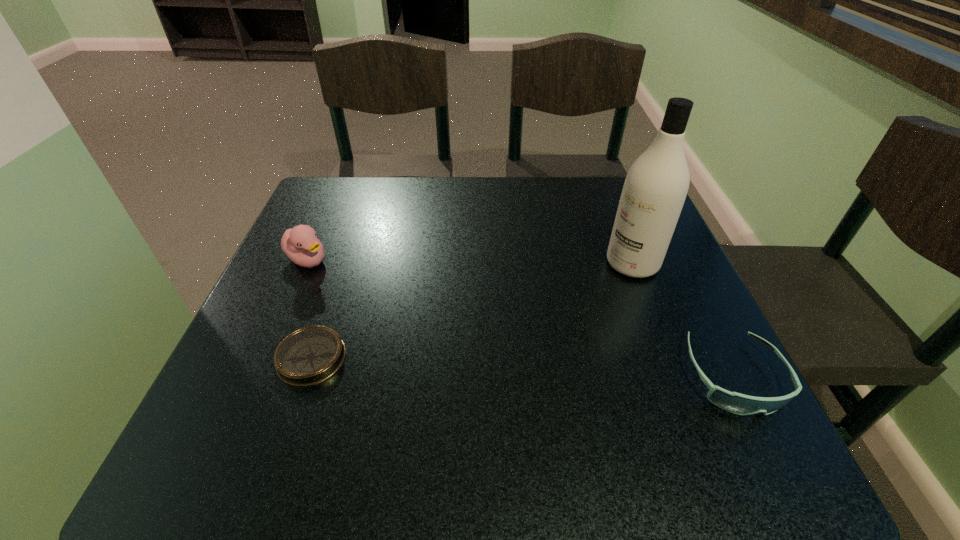
Where is `free space at the near edge`? free space at the near edge is located at coordinates (501, 414).

Image resolution: width=960 pixels, height=540 pixels. What are the coordinates of `vacant space at the left edge of the desktop` in the screenshot? It's located at (340, 232).

You are a GUI agent. You are given a task and a screenshot of the screen. Output one action in this format:
    pyautogui.click(x=<x>, y=<y>)
    Task: Click on the vacant area at the right edge of the desktop
    This screenshot has height=540, width=960.
    Given the screenshot: What is the action you would take?
    pyautogui.click(x=619, y=286)

The image size is (960, 540). In order to click on vacant space at the near left corner of the desktop in this screenshot , I will do `click(214, 400)`.

In order to click on vacant space at the far right corner of the desktop in this screenshot , I will do `click(612, 201)`.

Identify the location of free space between the duckling and the shortest object. The image size is (960, 540). (310, 309).

What are the coordinates of `free area in between the duckling and the shortest object` in the screenshot? It's located at (310, 309).

Identify the location of vacant area between the second tallest object and the goggles. Image resolution: width=960 pixels, height=540 pixels. (520, 318).

The image size is (960, 540). Find the location of `vacant area between the third tallest object and the tallest object`. vacant area between the third tallest object and the tallest object is located at coordinates (684, 320).

Where is `vacant space that's between the shortest object and the tallest object`? Image resolution: width=960 pixels, height=540 pixels. vacant space that's between the shortest object and the tallest object is located at coordinates (472, 310).